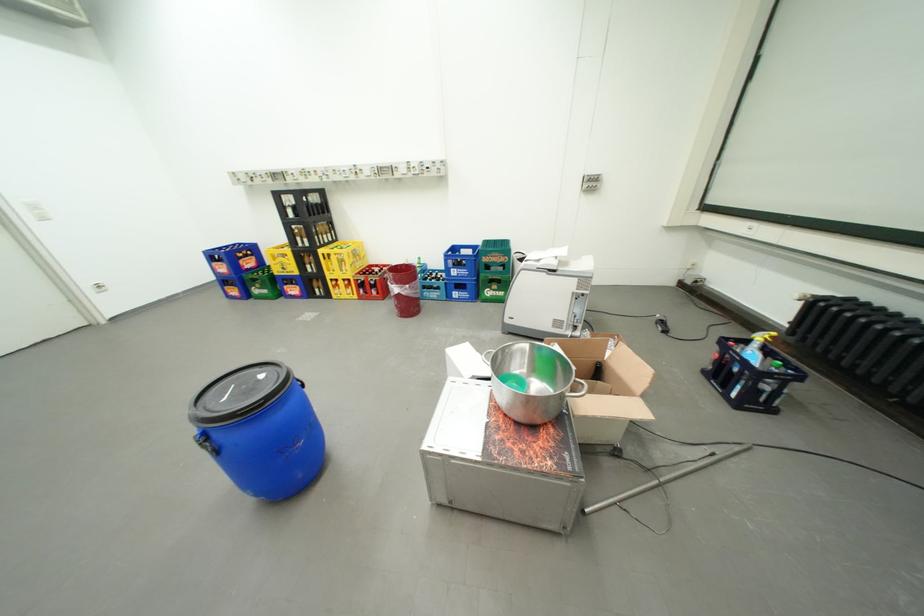
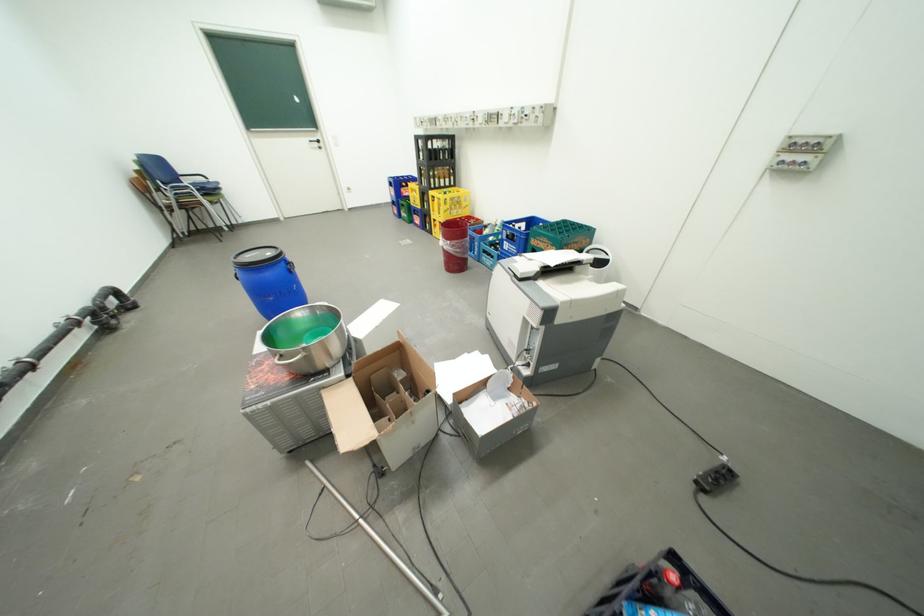
Locate, in the second image, the point that corresponds to (x=473, y=276) in the first image.

(523, 253)